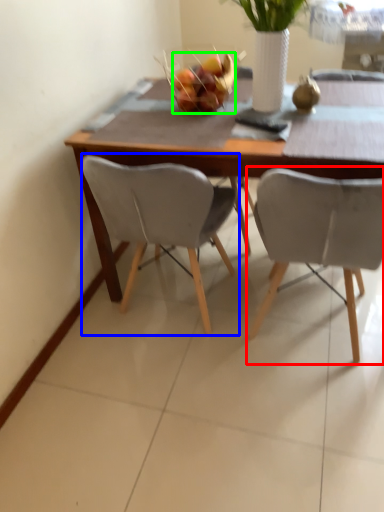
Question: Based on their relative distances, which object is nearer to chair (highlighted by a red box)? Choose from chair (highlighted by a blue box) and fruit (highlighted by a green box).

Choices:
 (A) chair
 (B) fruit

Answer: (A)